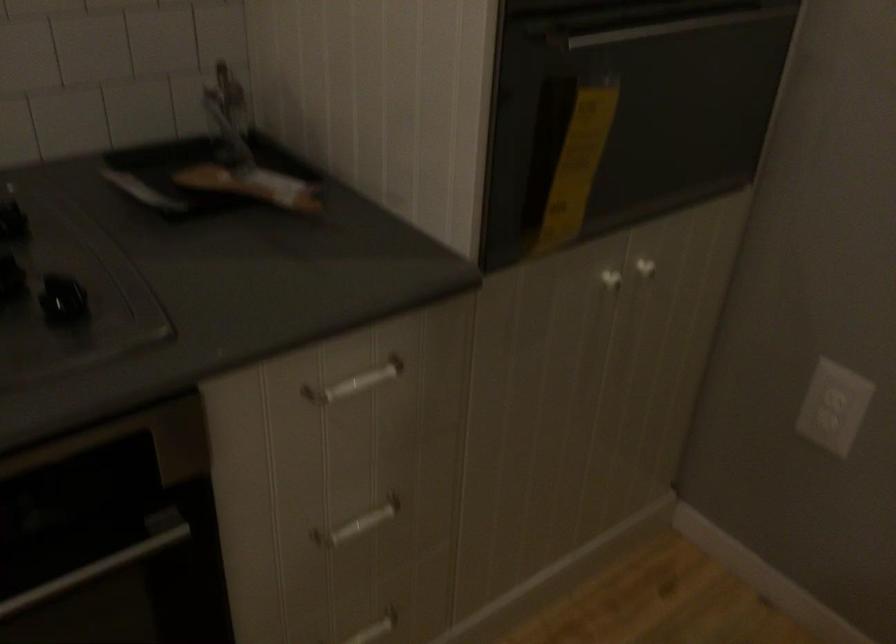
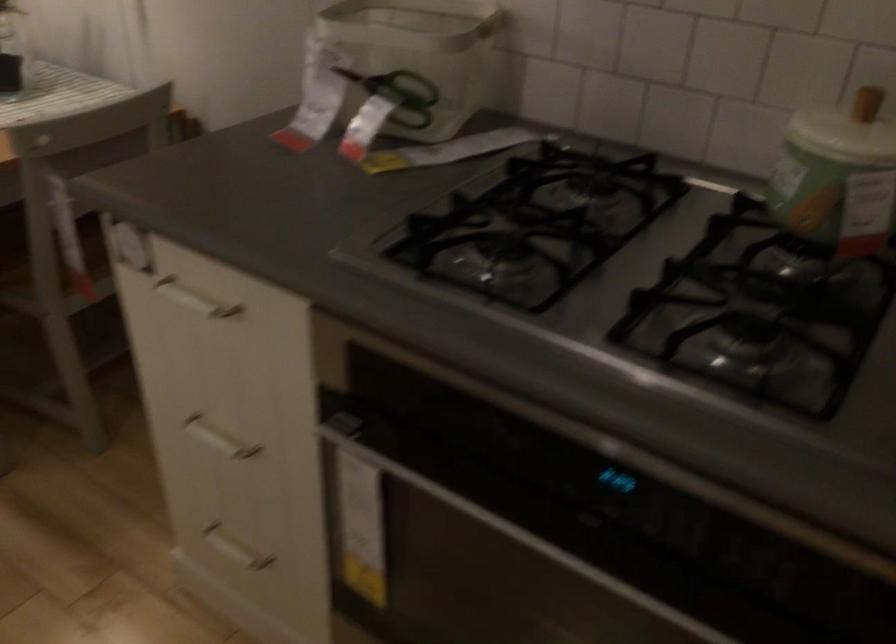
The images are taken continuously from a first-person perspective. In which direction is your viewpoint rotating?

The camera rotated toward left-down.